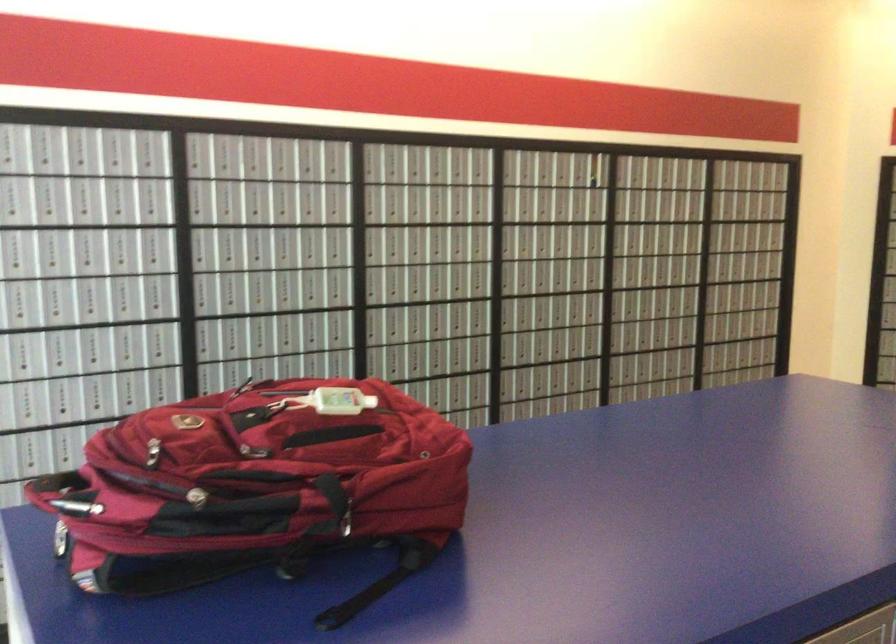
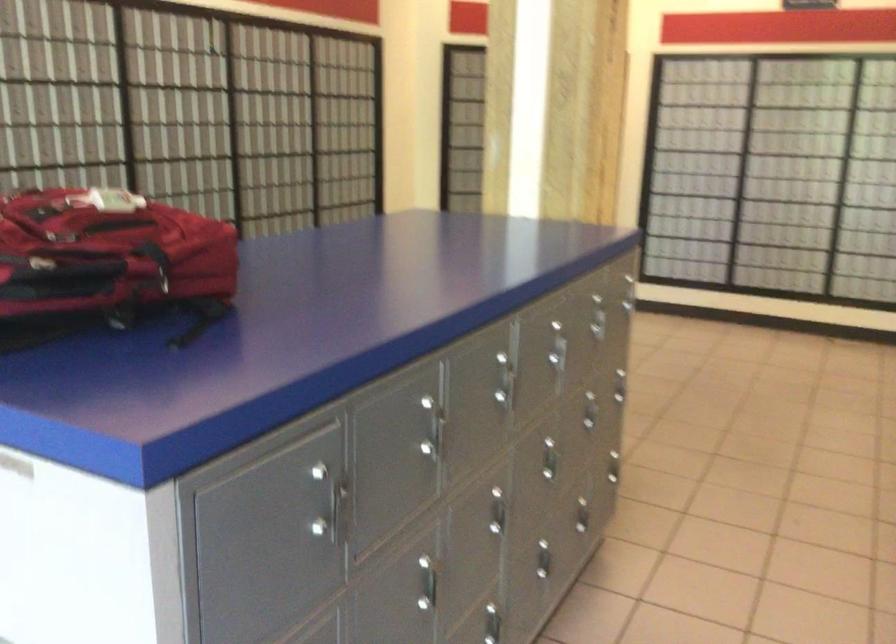
Locate, in the second image, the point that corresponds to point (334, 506) in the first image.

(156, 263)